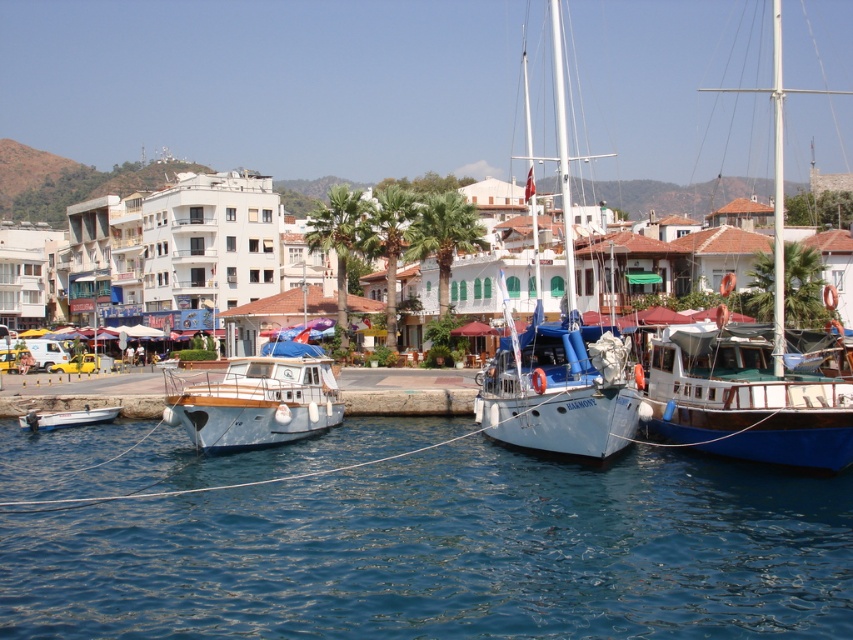
Question: Can you confirm if white wooden boat at right is thinner than white matte boat at lower left?

Choices:
 (A) yes
 (B) no

Answer: (B)

Question: Which of the following is the farthest from the observer?

Choices:
 (A) (503, 291)
 (B) (788, 408)
 (C) (683, 378)
 (D) (753, 609)

Answer: (A)

Question: Based on their relative distances, which object is nearer to the white wooden boat at right?

Choices:
 (A) white matte boat at lower left
 (B) blue polished wood sailboat at center
 (C) matte blue wooden boat at center

Answer: (B)

Question: Which point is closer to the camera?

Choices:
 (A) blue water at center
 (B) white glossy sailboat at center
 (C) white wooden boat at right

Answer: (A)

Question: Considering the relative positions of wooden sailboat at right and white matte boat at lower left in the image provided, where is wooden sailboat at right located with respect to white matte boat at lower left?

Choices:
 (A) left
 (B) right

Answer: (B)

Question: Can you confirm if blue water at center is bigger than matte blue wooden boat at center?

Choices:
 (A) no
 (B) yes

Answer: (B)